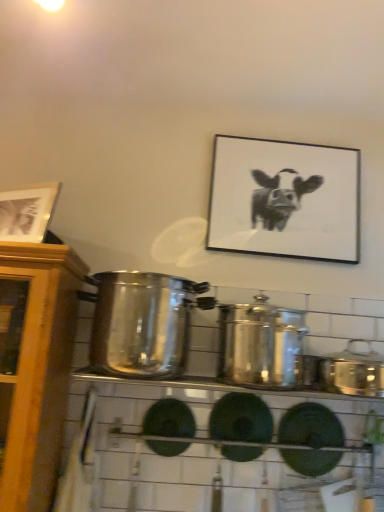
Question: From the image's perspective, does black matte picture frame at upper center, positioned as the 1th picture frame in right-to-left order, appear lower than satin silver pot at center, which is the third crock pot from right to left?

Choices:
 (A) yes
 (B) no

Answer: (B)

Question: Considering the relative sizes of black matte picture frame at upper center, the second picture frame when ordered from left to right, and satin silver pot at center, which is the third crock pot from right to left, in the image provided, is black matte picture frame at upper center, the second picture frame when ordered from left to right, shorter than satin silver pot at center, which is the third crock pot from right to left,?

Choices:
 (A) no
 (B) yes

Answer: (A)

Question: Is black matte picture frame at upper center, placed as the second picture frame when sorted from front to back, bigger than satin silver pot at center, placed as the first crock pot when sorted from left to right?

Choices:
 (A) no
 (B) yes

Answer: (A)

Question: Is black matte picture frame at upper center, arranged as the first picture frame when viewed from the back, oriented towards satin silver pot at center, placed as the first crock pot when sorted from left to right?

Choices:
 (A) no
 (B) yes

Answer: (A)

Question: Are black matte picture frame at upper center, the second picture frame when ordered from left to right, and satin silver pot at center, which is the third crock pot from right to left, making contact?

Choices:
 (A) yes
 (B) no

Answer: (B)

Question: Is satin silver pot at center, placed as the first crock pot when sorted from left to right, wider or thinner than wooden picture frame at upper left, the 1th picture frame from the left?

Choices:
 (A) thin
 (B) wide

Answer: (B)

Question: Visually, is satin silver pot at center, placed as the first crock pot when sorted from left to right, positioned to the left or to the right of wooden picture frame at upper left, the second picture frame when ordered from right to left?

Choices:
 (A) right
 (B) left

Answer: (A)

Question: Considering the positions of point (130, 331) and point (26, 190), is point (130, 331) closer or farther from the camera than point (26, 190)?

Choices:
 (A) closer
 (B) farther

Answer: (A)

Question: From the image's perspective, is satin silver pot at center, which is the third crock pot from right to left, located above or below wooden picture frame at upper left, which is counted as the second picture frame, starting from the back?

Choices:
 (A) above
 (B) below

Answer: (B)

Question: Considering the positions of satin silver crock pot at right, the first crock pot in the right-to-left sequence, and wooden picture frame at upper left, the 1th picture frame from the left, in the image, is satin silver crock pot at right, the first crock pot in the right-to-left sequence, wider or thinner than wooden picture frame at upper left, the 1th picture frame from the left,?

Choices:
 (A) wide
 (B) thin

Answer: (A)

Question: Does point (375, 365) appear closer or farther from the camera than point (21, 206)?

Choices:
 (A) farther
 (B) closer

Answer: (B)

Question: Considering the positions of satin silver crock pot at right, the third crock pot in the left-to-right sequence, and wooden picture frame at upper left, the 1th picture frame from the left, in the image, is satin silver crock pot at right, the third crock pot in the left-to-right sequence, bigger or smaller than wooden picture frame at upper left, the 1th picture frame from the left,?

Choices:
 (A) small
 (B) big

Answer: (B)

Question: Would you say satin silver crock pot at right, the first crock pot in the right-to-left sequence, is to the left or to the right of wooden picture frame at upper left, which is counted as the second picture frame, starting from the back, in the picture?

Choices:
 (A) left
 (B) right

Answer: (B)

Question: Considering the positions of wooden picture frame at upper left, which is counted as the second picture frame, starting from the back, and black matte picture frame at upper center, placed as the second picture frame when sorted from front to back, in the image, is wooden picture frame at upper left, which is counted as the second picture frame, starting from the back, bigger or smaller than black matte picture frame at upper center, placed as the second picture frame when sorted from front to back,?

Choices:
 (A) big
 (B) small

Answer: (B)

Question: Considering the positions of point (16, 202) and point (226, 151), is point (16, 202) closer or farther from the camera than point (226, 151)?

Choices:
 (A) farther
 (B) closer

Answer: (B)